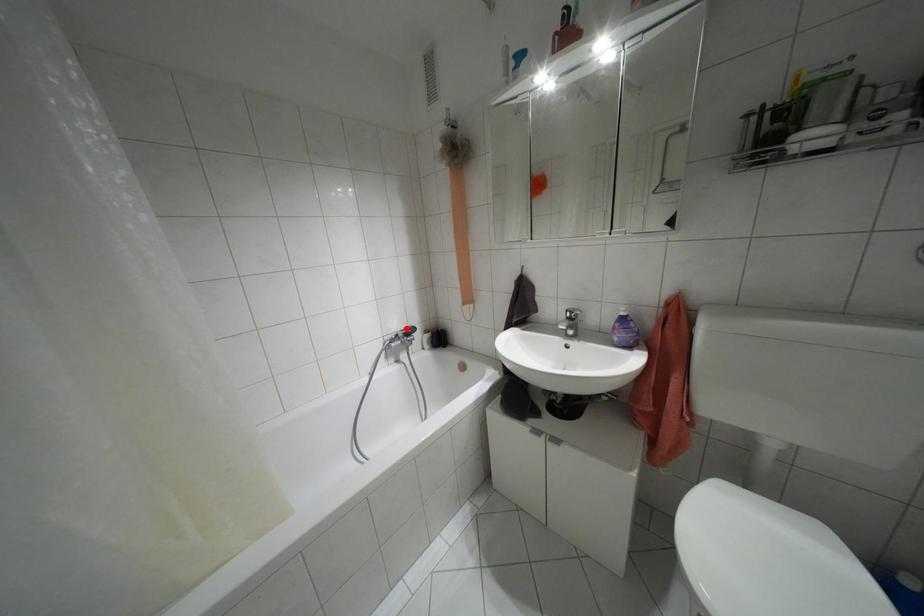
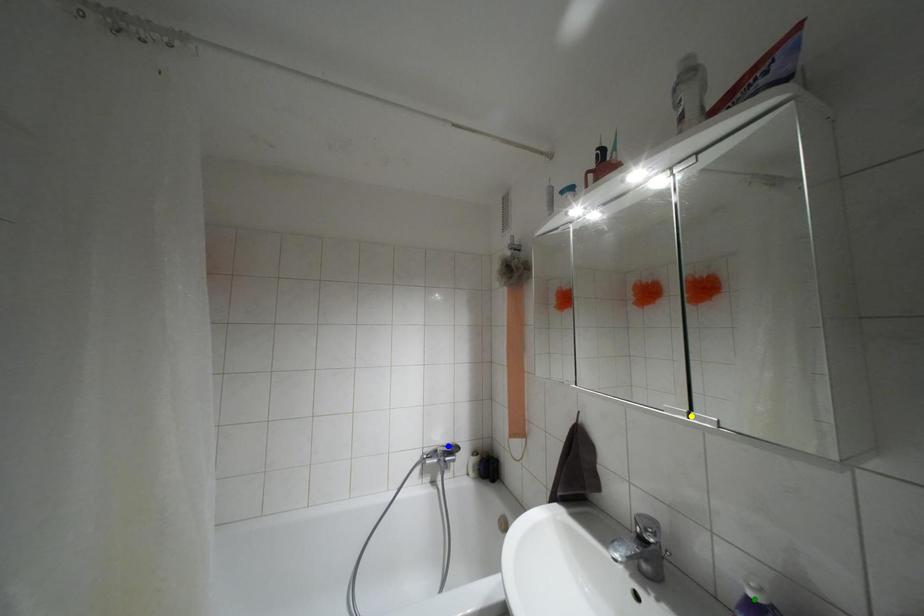
Question: I am providing you with two images of the same scene from different viewpoints. A red point is marked on the first image. You are given multiple points on the second image. Which point in image 2 is actually the same real-world point as the red point in image 1?

Choices:
 (A) green point
 (B) yellow point
 (C) blue point

Answer: (C)